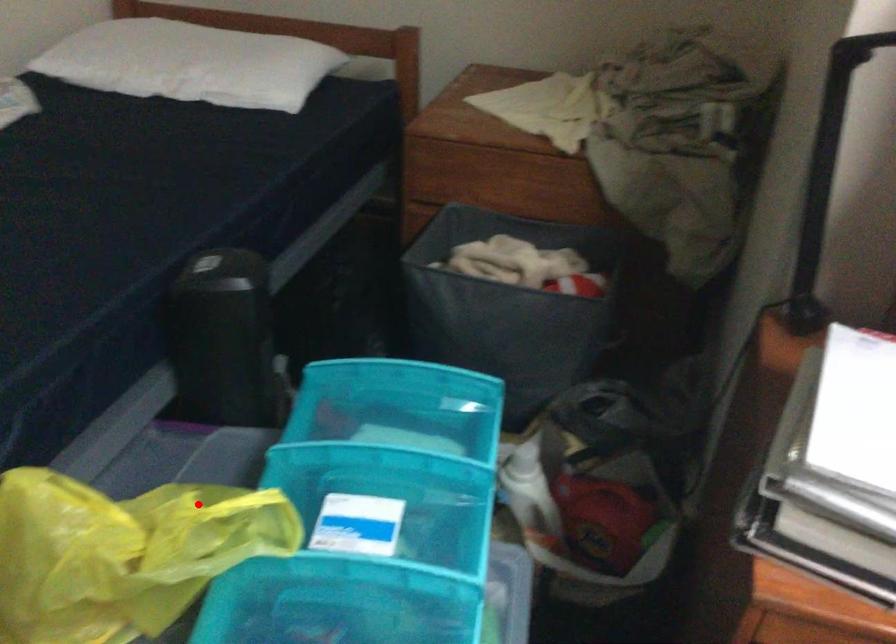
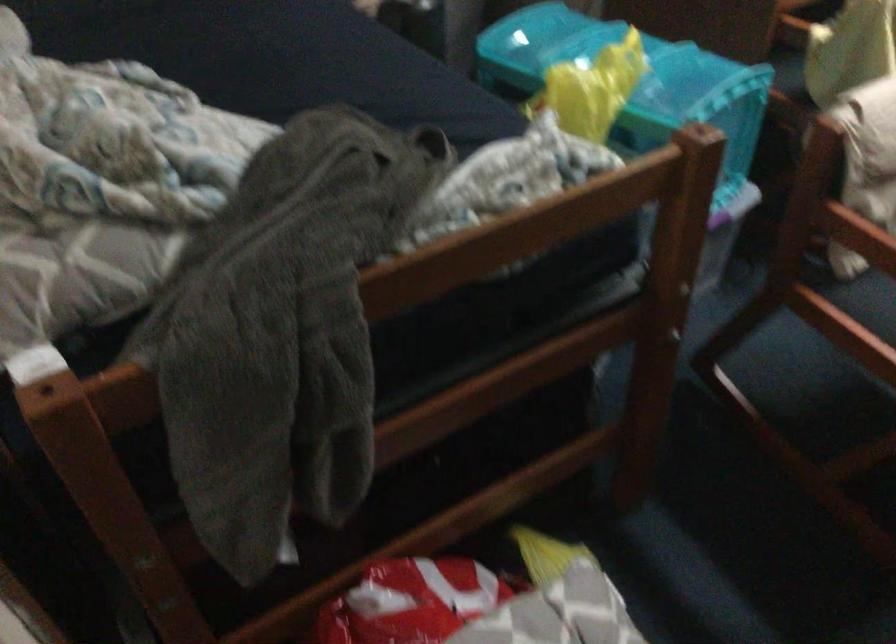
Where in the second image is the point corresponding to the highlighted location from the first image?

(600, 62)